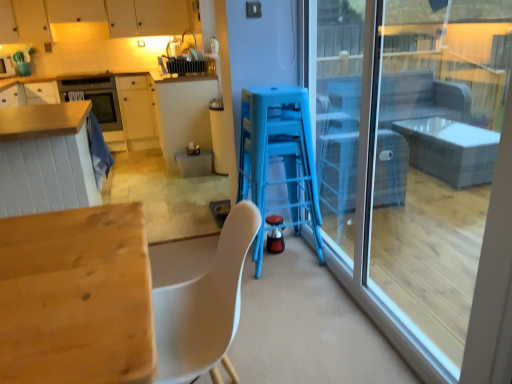
Question: Does matte wood cabinetry at left, the 1th cabinetry from the bottom, have a larger size compared to matte black oven at upper left?

Choices:
 (A) yes
 (B) no

Answer: (A)

Question: Can we say matte wood cabinetry at left, the 1th cabinetry from the bottom, lies outside matte black oven at upper left?

Choices:
 (A) no
 (B) yes

Answer: (B)

Question: Considering the relative sizes of matte wood cabinetry at left, the 1th cabinetry from the bottom, and matte black oven at upper left in the image provided, is matte wood cabinetry at left, the 1th cabinetry from the bottom, smaller than matte black oven at upper left?

Choices:
 (A) no
 (B) yes

Answer: (A)

Question: Is matte wood cabinetry at left, the 1th cabinetry from the bottom, closer to the viewer compared to matte black oven at upper left?

Choices:
 (A) yes
 (B) no

Answer: (A)

Question: From a real-world perspective, is matte wood cabinetry at left, which is the second cabinetry in top-to-bottom order, located beneath matte black oven at upper left?

Choices:
 (A) no
 (B) yes

Answer: (B)

Question: Considering the relative positions of blue plastic bar stool at center and shiny black kettle at center, the first appliance in the bottom-to-top sequence, in the image provided, is blue plastic bar stool at center to the left or to the right of shiny black kettle at center, the first appliance in the bottom-to-top sequence,?

Choices:
 (A) right
 (B) left

Answer: (A)

Question: In terms of size, does blue plastic bar stool at center appear bigger or smaller than shiny black kettle at center, the 1th appliance when ordered from right to left?

Choices:
 (A) small
 (B) big

Answer: (B)

Question: From their relative heights in the image, would you say blue plastic bar stool at center is taller or shorter than shiny black kettle at center, which is the second appliance in top-to-bottom order?

Choices:
 (A) short
 (B) tall

Answer: (B)

Question: Do you think blue plastic bar stool at center is within shiny black kettle at center, acting as the 2th appliance starting from the back, or outside of it?

Choices:
 (A) outside
 (B) inside

Answer: (A)

Question: Considering the relative positions of matte white toaster at upper left, the first appliance positioned from the top, and matte white cabinets at upper left, which appears as the first cabinetry when viewed from the top, in the image provided, is matte white toaster at upper left, the first appliance positioned from the top, to the left or to the right of matte white cabinets at upper left, which appears as the first cabinetry when viewed from the top,?

Choices:
 (A) right
 (B) left

Answer: (B)

Question: Would you say matte white toaster at upper left, the second appliance in the bottom-to-top sequence, is inside or outside matte white cabinets at upper left, which ranks as the second cabinetry in bottom-to-top order?

Choices:
 (A) outside
 (B) inside

Answer: (A)

Question: Is point (9, 74) positioned closer to the camera than point (48, 39)?

Choices:
 (A) closer
 (B) farther

Answer: (A)

Question: From a real-world perspective, relative to matte white cabinets at upper left, which appears as the first cabinetry when viewed from the top, is matte white toaster at upper left, the second appliance in the bottom-to-top sequence, vertically above or below?

Choices:
 (A) above
 (B) below

Answer: (B)

Question: Is blue plastic bar stool at center taller or shorter than translucent plastic trash bin at center, which is the 1th table from top to bottom?

Choices:
 (A) tall
 (B) short

Answer: (A)

Question: Based on their positions, is blue plastic bar stool at center located to the left or right of translucent plastic trash bin at center, the first table in the back-to-front sequence?

Choices:
 (A) right
 (B) left

Answer: (A)